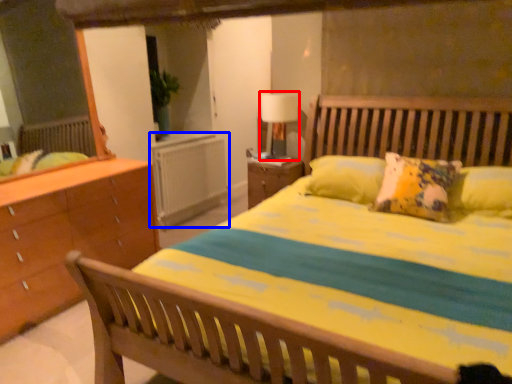
Question: Which object appears closest to the camera in this image, table lamp (highlighted by a red box) or radiator (highlighted by a blue box)?

Choices:
 (A) table lamp
 (B) radiator

Answer: (A)